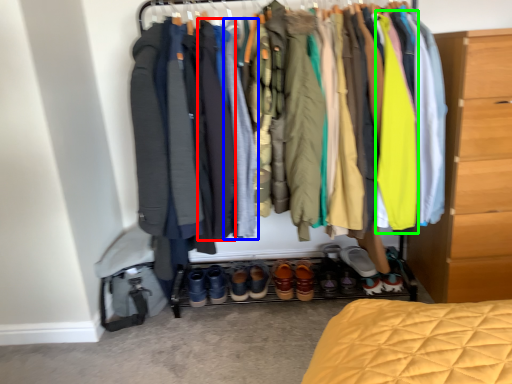
Question: Considering the real-world distances, which object is farthest from robe (highlighted by a red box)? robe (highlighted by a blue box) or garment (highlighted by a green box)?

Choices:
 (A) robe
 (B) garment

Answer: (B)